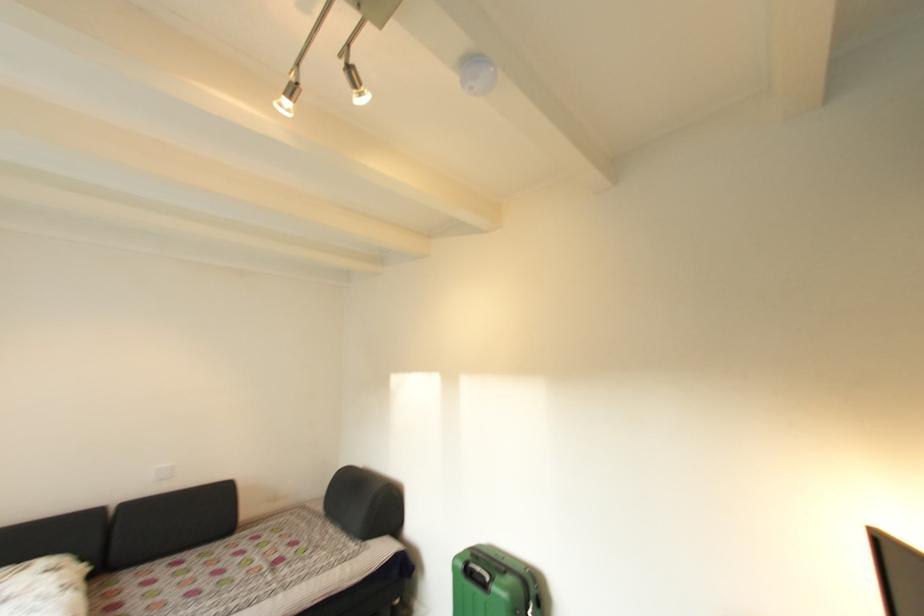
The height and width of the screenshot is (616, 924). I want to click on suitcase handle, so click(x=501, y=605).